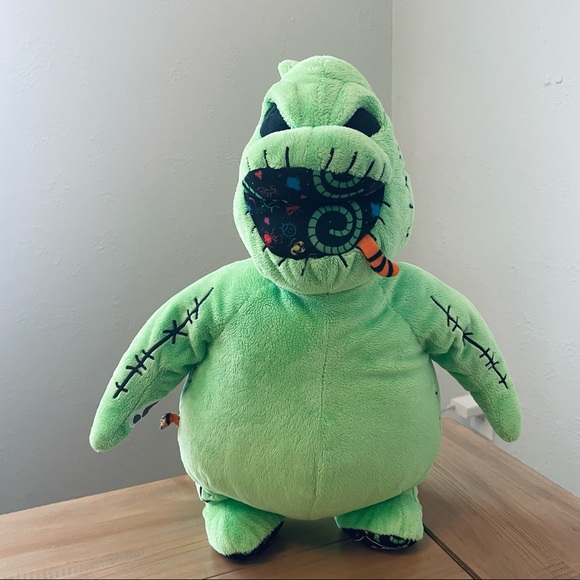
Locate an element on the screen. The height and width of the screenshot is (580, 580). stuffed animal is located at coordinates (292, 380).